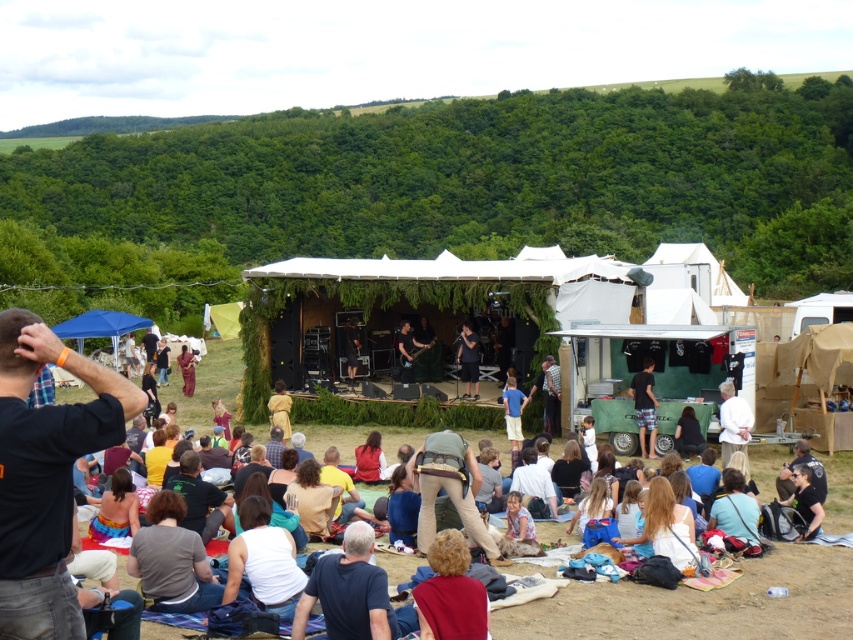
Question: Among these objects, which one is farthest from the camera?

Choices:
 (A) plaid shorts at center
 (B) dark blue uniform at lower right

Answer: (A)

Question: Which of these objects is positioned farthest from the dark brown leather jacket at center?

Choices:
 (A) dark blue uniform at lower right
 (B) plaid shorts at center
 (C) light blue denim shorts at center

Answer: (A)

Question: Is dark blue shirt at lower center further to the viewer compared to brown fabric dress at center?

Choices:
 (A) no
 (B) yes

Answer: (A)

Question: Is dark blue shirt at lower center closer to the viewer compared to dark brown leather guitar at center?

Choices:
 (A) no
 (B) yes

Answer: (B)

Question: Which object is the closest to the dark blue shirt at lower center?

Choices:
 (A) dark brown leather guitar at center
 (B) black cotton shirt at lower left
 (C) dark blue uniform at lower right
 (D) brown fabric dress at center

Answer: (B)

Question: Is dark brown leather jacket at center bigger than dark brown leather guitar at center?

Choices:
 (A) no
 (B) yes

Answer: (B)